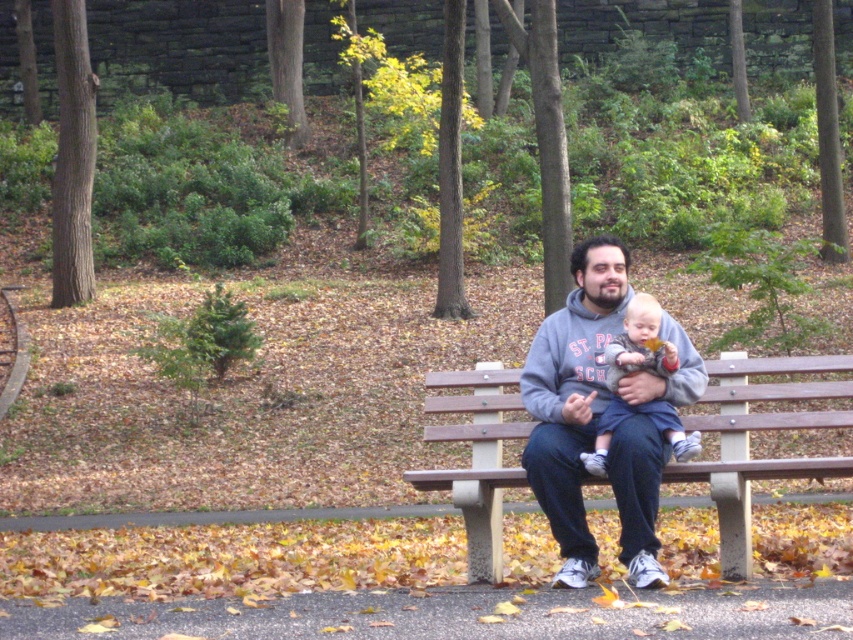
Question: Does wooden bench at center lie behind blue denim pants at center?

Choices:
 (A) yes
 (B) no

Answer: (A)

Question: Can you confirm if matte gray hoodie at center is positioned to the right of blue denim pants at center?

Choices:
 (A) yes
 (B) no

Answer: (B)

Question: Which point is farther from the camera taking this photo?

Choices:
 (A) (599, 467)
 (B) (770, 360)
 (C) (645, 422)

Answer: (B)

Question: Among these objects, which one is nearest to the camera?

Choices:
 (A) wooden bench at center
 (B) blue denim pants at center
 (C) matte gray hoodie at center

Answer: (C)

Question: Is wooden bench at center behind blue denim pants at center?

Choices:
 (A) no
 (B) yes

Answer: (B)

Question: Which point is farther from the camera taking this photo?

Choices:
 (A) (631, 292)
 (B) (640, 337)
 (C) (740, 371)

Answer: (C)